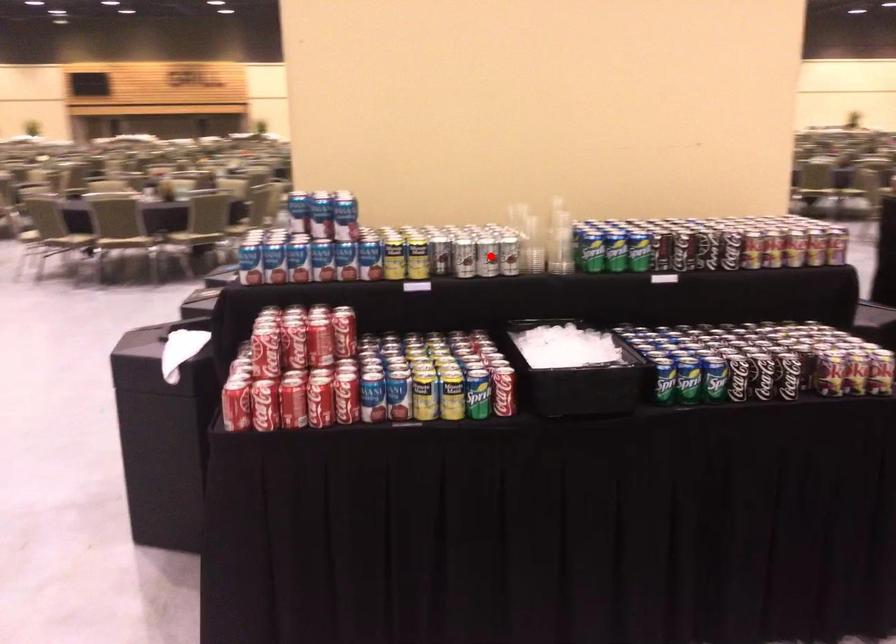
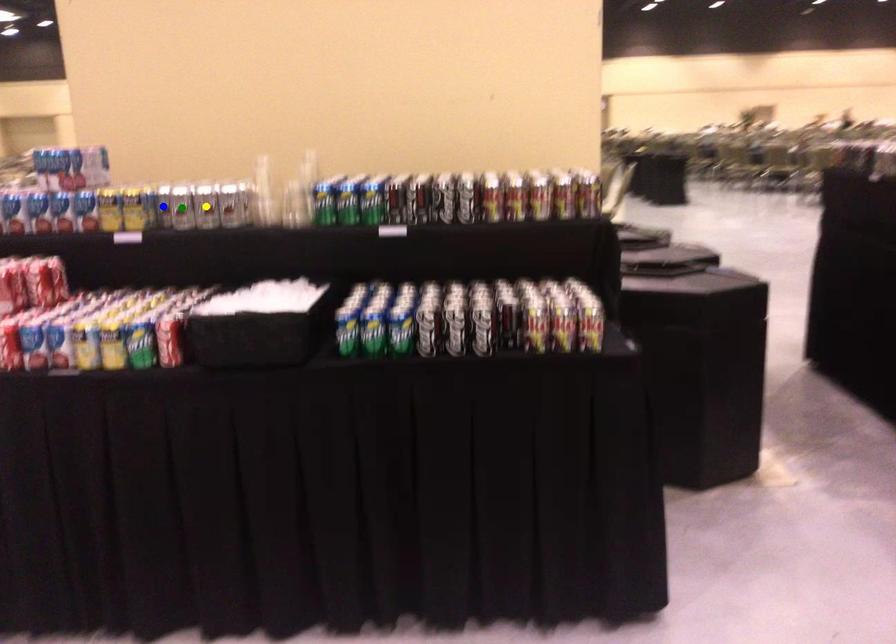
Question: I am providing you with two images of the same scene from different viewpoints. A red point is marked on the first image. You are given multiple points on the second image. Which spot in image 2 lines up with the point in image 1?

Choices:
 (A) green point
 (B) yellow point
 (C) blue point

Answer: (B)